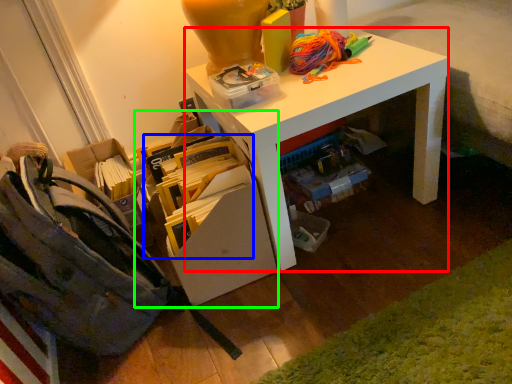
Question: Based on their relative distances, which object is farther from desk (highlighted by a red box)? Choose from book (highlighted by a blue box) and shelf (highlighted by a green box).

Choices:
 (A) book
 (B) shelf

Answer: (A)